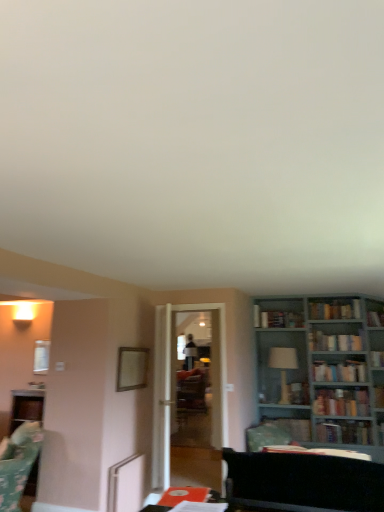
Question: Is hardcover book at upper center, which ranks as the 5th book in front-to-back order, turned away from transparent glass door at center?

Choices:
 (A) no
 (B) yes

Answer: (A)

Question: From a real-world perspective, is hardcover book at upper center, acting as the 4th book starting from the back, on transparent glass door at center?

Choices:
 (A) yes
 (B) no

Answer: (A)

Question: From the image's perspective, would you say hardcover book at upper center, which ranks as the 5th book in front-to-back order, is positioned over transparent glass door at center?

Choices:
 (A) no
 (B) yes

Answer: (B)

Question: Is hardcover book at upper center, which ranks as the 5th book in front-to-back order, smaller than transparent glass door at center?

Choices:
 (A) no
 (B) yes

Answer: (B)

Question: From a real-world perspective, is hardcover book at upper center, which ranks as the 5th book in front-to-back order, physically below transparent glass door at center?

Choices:
 (A) no
 (B) yes

Answer: (A)

Question: Does point (354, 373) appear closer or farther from the camera than point (365, 406)?

Choices:
 (A) farther
 (B) closer

Answer: (B)

Question: In terms of height, does hardcover book at right, which ranks as the 4th book in front-to-back order, look taller or shorter compared to teal wooden bookcase at right?

Choices:
 (A) tall
 (B) short

Answer: (B)

Question: Considering the positions of hardcover book at right, which is counted as the fifth book, starting from the back, and teal wooden bookcase at right in the image, is hardcover book at right, which is counted as the fifth book, starting from the back, wider or thinner than teal wooden bookcase at right?

Choices:
 (A) thin
 (B) wide

Answer: (A)

Question: Is hardcover book at right, which is counted as the fifth book, starting from the back, in front of or behind teal wooden bookcase at right in the image?

Choices:
 (A) front
 (B) behind

Answer: (B)

Question: From the image's perspective, is teal wooden bookcase at right located above or below hardcover book at right, which ranks as the 4th book in front-to-back order?

Choices:
 (A) above
 (B) below

Answer: (B)

Question: Is teal wooden bookcase at right inside the boundaries of hardcover book at right, which is counted as the fifth book, starting from the back, or outside?

Choices:
 (A) outside
 (B) inside

Answer: (A)

Question: Visually, is teal wooden bookcase at right positioned to the left or to the right of hardcover book at right, which is counted as the fifth book, starting from the back?

Choices:
 (A) right
 (B) left

Answer: (B)

Question: Looking at the image, does teal wooden bookcase at right seem bigger or smaller compared to hardcover book at right, which is counted as the fifth book, starting from the back?

Choices:
 (A) small
 (B) big

Answer: (B)

Question: From a real-world perspective, is teal wooden bookcase at right physically located above or below green fabric swivel chair at lower left?

Choices:
 (A) below
 (B) above

Answer: (B)

Question: Considering their positions, is teal wooden bookcase at right located in front of or behind green fabric swivel chair at lower left?

Choices:
 (A) front
 (B) behind

Answer: (B)